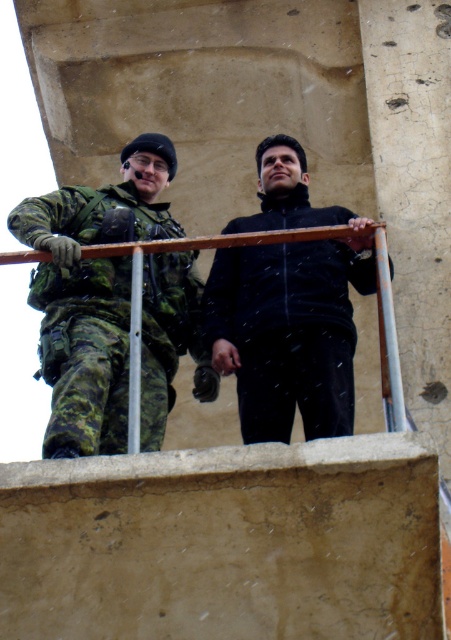
Is the position of camouflage fabric uniform at left less distant than that of black matte jacket at center?

Yes.

Image resolution: width=451 pixels, height=640 pixels. What do you see at coordinates (92, 292) in the screenshot? I see `camouflage fabric uniform at left` at bounding box center [92, 292].

Which is behind, point (58, 456) or point (288, 138)?

Positioned behind is point (288, 138).

Locate an element on the screen. This screenshot has width=451, height=640. camouflage fabric uniform at left is located at coordinates (92, 292).